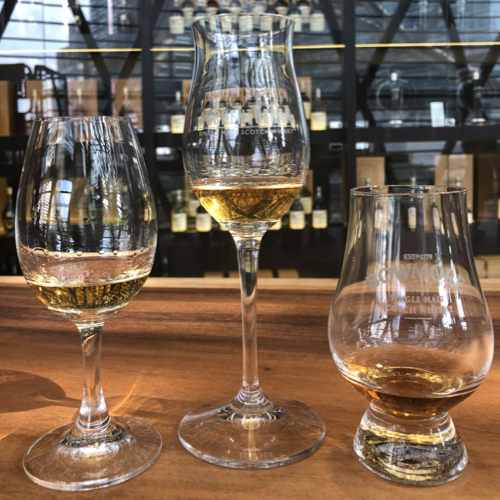
Identify the location of medium glass. (75, 239).